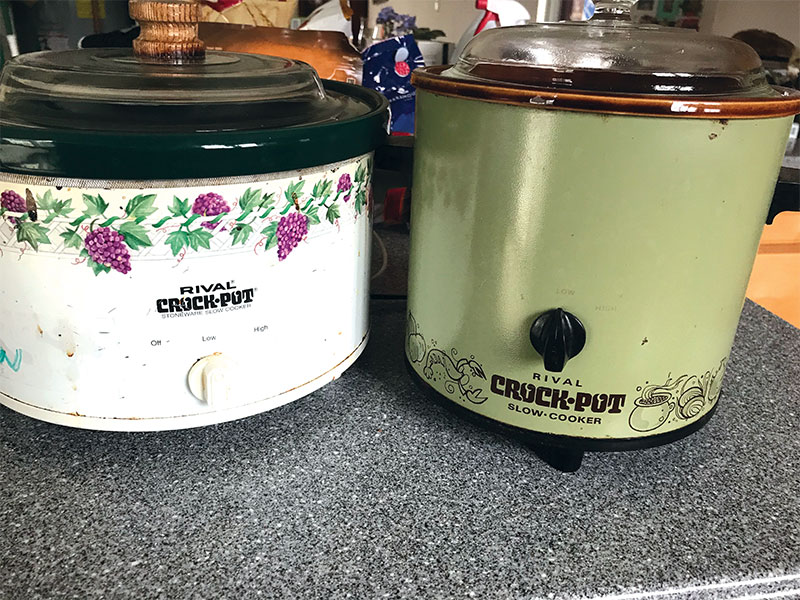
You are a GUI agent. You are given a task and a screenshot of the screen. Output one action in this format:
    pyautogui.click(x=<x>, y=<y>)
    Task: Click on the countertop
    
    Given the screenshot: What is the action you would take?
    pyautogui.click(x=372, y=495)